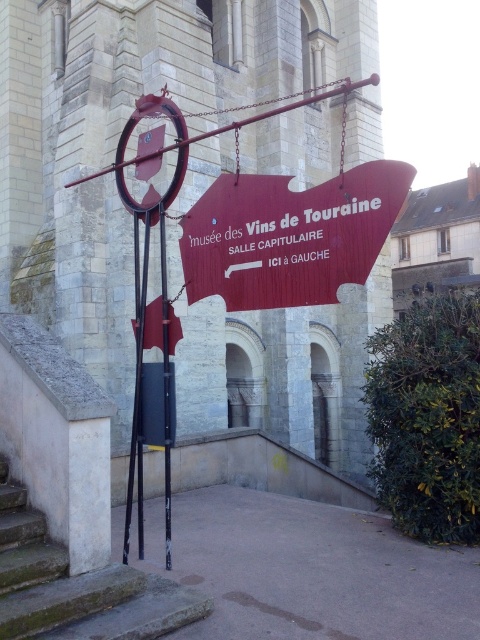
You are a tour guide leading a group to the museum. You see the matte stone church at center and the red matte sign at center. Which object is wider?

The matte stone church at center is wider than the red matte sign at center.

You are standing at the base of the concrete stairs at lower left and want to find the entrance to the Mus?e des Vins de Touraine. According to the signboard, where should you go relative to the red matte sign at center?

The red matte sign at center is to the right of the concrete stairs at lower left. Since the sign says ICI ? GAUCHE, meaning Here to the Left, you should go to the left of the red matte sign at center to find the entrance.

You are standing in front of the historic stone building and want to take a photo of the red matte sign at center. If your camera can focus on objects up to 10 meters away, will it be able to capture the sign clearly?

The red matte sign at center is 9.31 meters away from the camera. Since the camera can focus up to 10 meters, it will be able to capture the sign clearly.